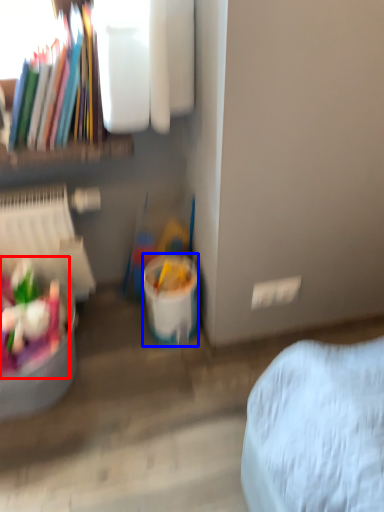
Question: Which of the following is the closest to the observer, food (highlighted by a red box) or bucket (highlighted by a blue box)?

Choices:
 (A) food
 (B) bucket

Answer: (A)